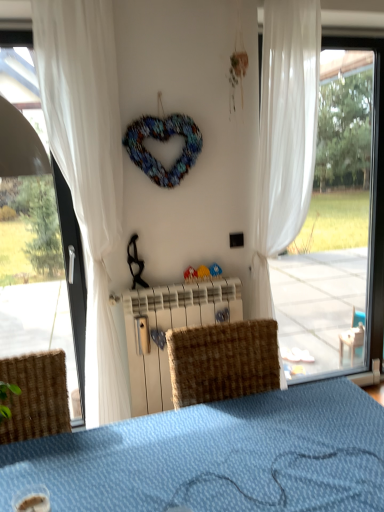
Question: Would you say transparent glass window at right contains white plastic radiator at center?

Choices:
 (A) no
 (B) yes

Answer: (A)

Question: Is transparent glass window at right oriented away from white plastic radiator at center?

Choices:
 (A) no
 (B) yes

Answer: (A)

Question: Is transparent glass window at right thinner than white plastic radiator at center?

Choices:
 (A) yes
 (B) no

Answer: (A)

Question: Can you confirm if transparent glass window at right is shorter than white plastic radiator at center?

Choices:
 (A) no
 (B) yes

Answer: (A)

Question: Is transparent glass window at right smaller than white plastic radiator at center?

Choices:
 (A) yes
 (B) no

Answer: (B)

Question: Considering the positions of transparent glass window at right and white plastic radiator at center in the image, is transparent glass window at right taller or shorter than white plastic radiator at center?

Choices:
 (A) short
 (B) tall

Answer: (B)

Question: Is transparent glass window at right in front of or behind white plastic radiator at center in the image?

Choices:
 (A) front
 (B) behind

Answer: (B)

Question: Which is correct: transparent glass window at right is inside white plastic radiator at center, or outside of it?

Choices:
 (A) outside
 (B) inside

Answer: (A)

Question: Is point (372, 94) positioned closer to the camera than point (155, 323)?

Choices:
 (A) closer
 (B) farther

Answer: (B)

Question: In terms of height, does white plastic radiator at center look taller or shorter compared to white sheer curtain at left, which is the 1th curtain from left to right?

Choices:
 (A) tall
 (B) short

Answer: (B)

Question: Considering the positions of white plastic radiator at center and white sheer curtain at left, which is the 1th curtain from left to right, in the image, is white plastic radiator at center wider or thinner than white sheer curtain at left, which is the 1th curtain from left to right,?

Choices:
 (A) thin
 (B) wide

Answer: (A)

Question: From the image's perspective, is white plastic radiator at center above or below white sheer curtain at left, the second curtain when ordered from right to left?

Choices:
 (A) below
 (B) above

Answer: (A)

Question: Is white plastic radiator at center spatially inside white sheer curtain at left, which is the 1th curtain from left to right, or outside of it?

Choices:
 (A) outside
 (B) inside

Answer: (A)

Question: From their relative heights in the image, would you say white sheer curtain at center, which is the second curtain in left-to-right order, is taller or shorter than transparent glass window at right?

Choices:
 (A) tall
 (B) short

Answer: (B)

Question: From the image's perspective, is white sheer curtain at center, the first curtain in the right-to-left sequence, positioned above or below transparent glass window at right?

Choices:
 (A) above
 (B) below

Answer: (A)